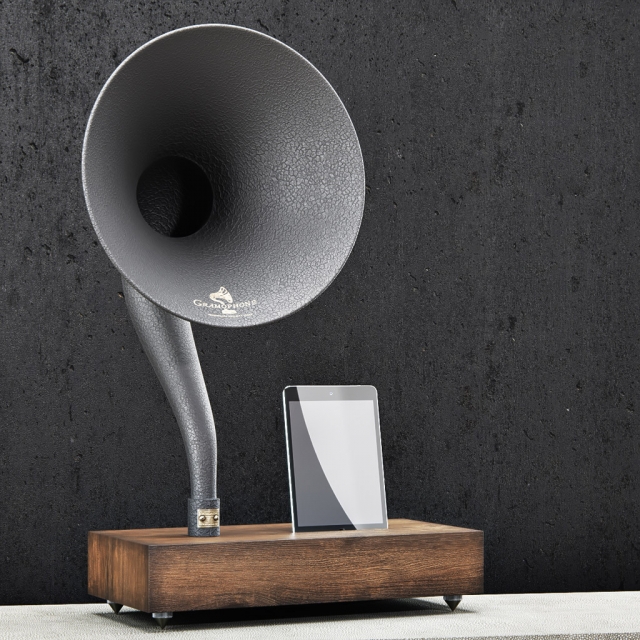
Locate an element on the screen. The image size is (640, 640). white table is located at coordinates (504, 605).